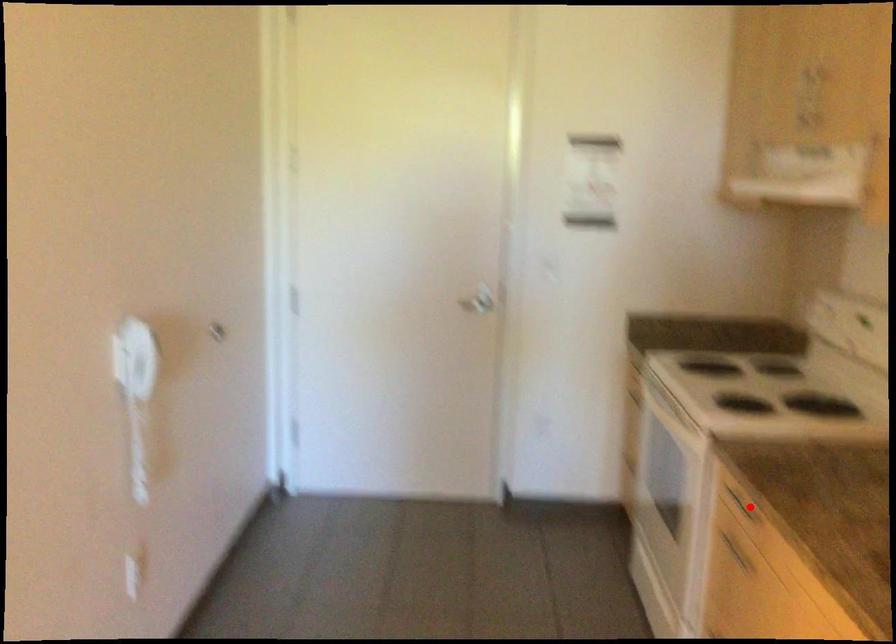
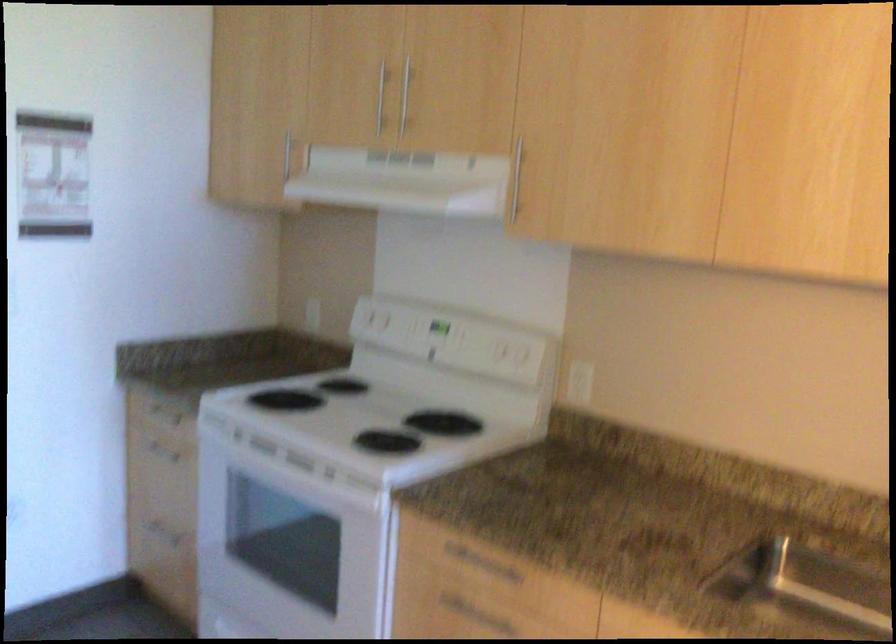
Question: I am providing you with two images of the same scene from different viewpoints. Image1 has a red point marked. In image2, the corresponding 3D location appears at what relative position? Reply with the corresponding letter.

Choices:
 (A) Closer
 (B) Farther

Answer: (A)